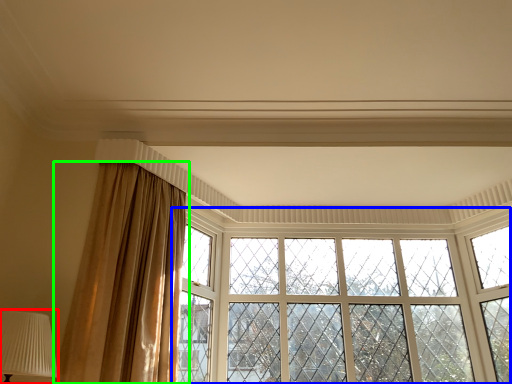
Question: Which object is positioned farthest from table lamp (highlighted by a red box)? Select from window (highlighted by a blue box) and curtain (highlighted by a green box).

Choices:
 (A) window
 (B) curtain

Answer: (A)